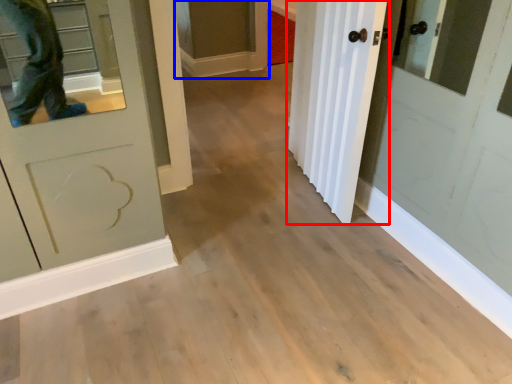
Question: Which of the following is the farthest to the observer, door (highlighted by a red box) or cabinetry (highlighted by a blue box)?

Choices:
 (A) door
 (B) cabinetry

Answer: (B)